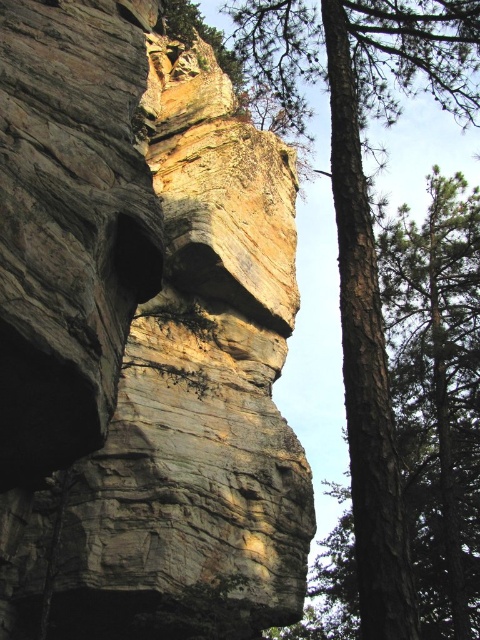
You are standing in front of the scene described. Where is the rustic stone cliff face at center located in terms of its 2D coordinates?

The rustic stone cliff face at center is located at the 2D coordinates of point (142, 337).

You are a hiker standing at the base of the rustic stone cliff face at center. You notice a specific point marked at coordinates point (x=142, y=337). Based on the image, what does this point indicate about the location of the rustic stone cliff face at center?

The point (x=142, y=337) marks the location of the rustic stone cliff face at center, indicating its central position in the image.

You are a hiker planning to cross between the rustic stone cliff face at center and the brown rough bark tree at right. Given that your backpack is 1 meter wide, can you fit through the space between them?

The rustic stone cliff face at center is narrower than the brown rough bark tree at right. However, since the exact width of the cliff face isn not provided, we cannot determine if the 1 meter wide backpack can fit through the space between them.